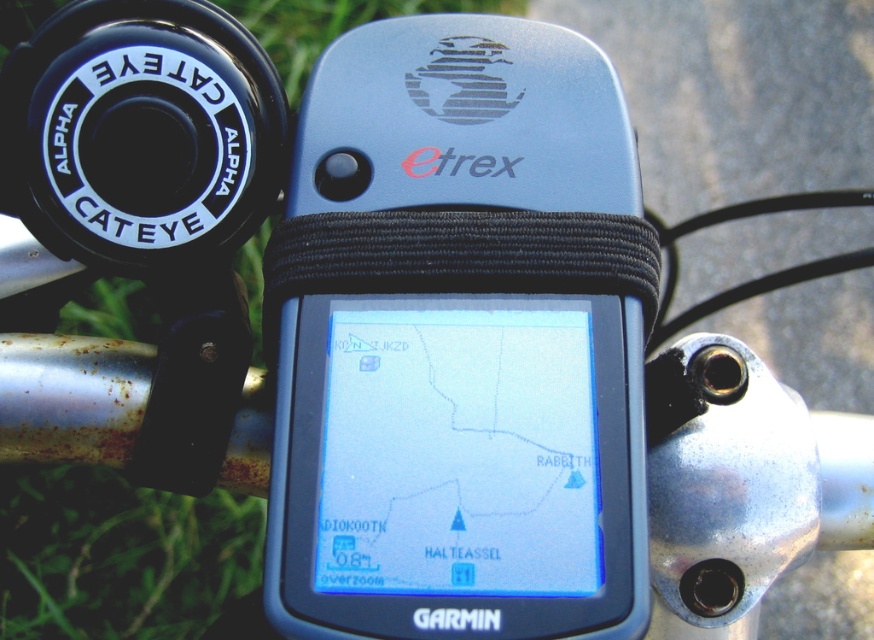
Is blue plastic gps at center above green grass at lower left?

Actually, blue plastic gps at center is below green grass at lower left.

Does blue plastic gps at center have a larger size compared to green grass at lower left?

No, blue plastic gps at center is not bigger than green grass at lower left.

Locate an element on the screen. Image resolution: width=874 pixels, height=640 pixels. blue plastic gps at center is located at coordinates (459, 340).